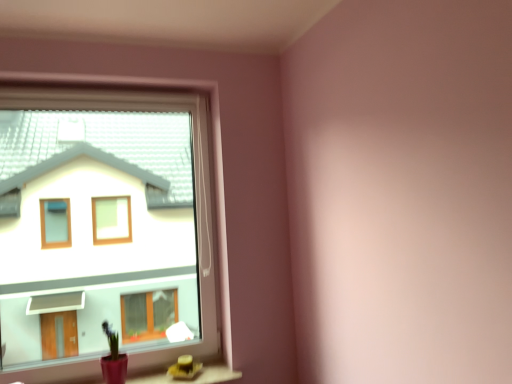
Question: Is matte pink pot at lower left wider than transparent plastic window at upper left?

Choices:
 (A) no
 (B) yes

Answer: (B)

Question: Does matte pink pot at lower left have a lesser width compared to transparent plastic window at upper left?

Choices:
 (A) yes
 (B) no

Answer: (B)

Question: From a real-world perspective, is matte pink pot at lower left positioned over transparent plastic window at upper left based on gravity?

Choices:
 (A) yes
 (B) no

Answer: (B)

Question: Is matte pink pot at lower left far away from transparent plastic window at upper left?

Choices:
 (A) yes
 (B) no

Answer: (B)

Question: From the image's perspective, is matte pink pot at lower left on top of transparent plastic window at upper left?

Choices:
 (A) no
 (B) yes

Answer: (A)

Question: Considering the relative sizes of matte pink pot at lower left and transparent plastic window at upper left in the image provided, is matte pink pot at lower left taller than transparent plastic window at upper left?

Choices:
 (A) no
 (B) yes

Answer: (A)

Question: Can you confirm if transparent plastic window at upper left is thinner than matte pink pot at lower left?

Choices:
 (A) no
 (B) yes

Answer: (B)

Question: Is transparent plastic window at upper left aimed at matte pink pot at lower left?

Choices:
 (A) yes
 (B) no

Answer: (A)

Question: From a real-world perspective, is transparent plastic window at upper left below matte pink pot at lower left?

Choices:
 (A) yes
 (B) no

Answer: (B)

Question: Considering the relative positions of transparent plastic window at upper left and matte pink pot at lower left in the image provided, is transparent plastic window at upper left behind matte pink pot at lower left?

Choices:
 (A) yes
 (B) no

Answer: (B)

Question: Can you confirm if transparent plastic window at upper left is positioned to the left of matte pink pot at lower left?

Choices:
 (A) no
 (B) yes

Answer: (B)

Question: Considering the relative sizes of transparent plastic window at upper left and matte pink pot at lower left in the image provided, is transparent plastic window at upper left taller than matte pink pot at lower left?

Choices:
 (A) no
 (B) yes

Answer: (B)

Question: Considering the positions of matte pink pot at lower left and transparent plastic window at upper left in the image, is matte pink pot at lower left bigger or smaller than transparent plastic window at upper left?

Choices:
 (A) big
 (B) small

Answer: (B)